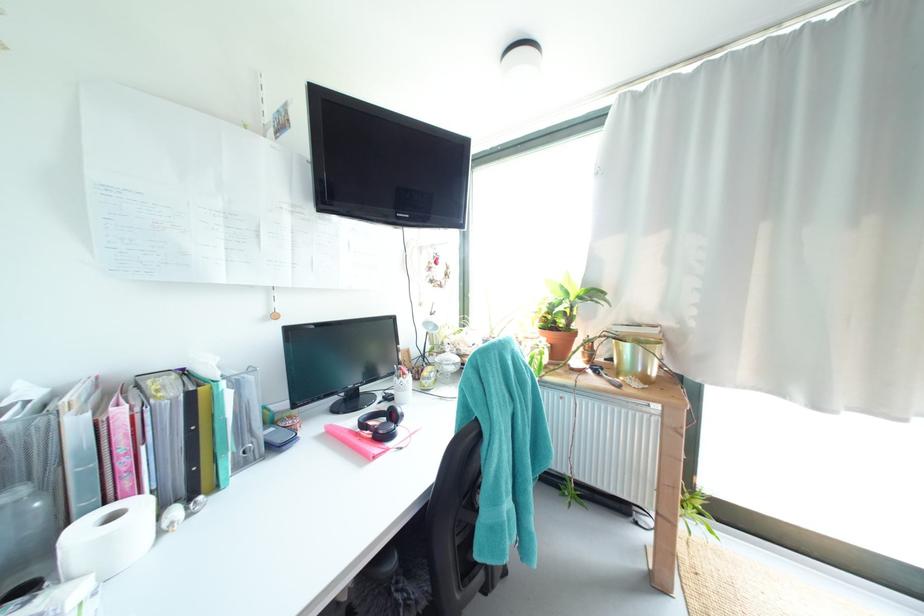
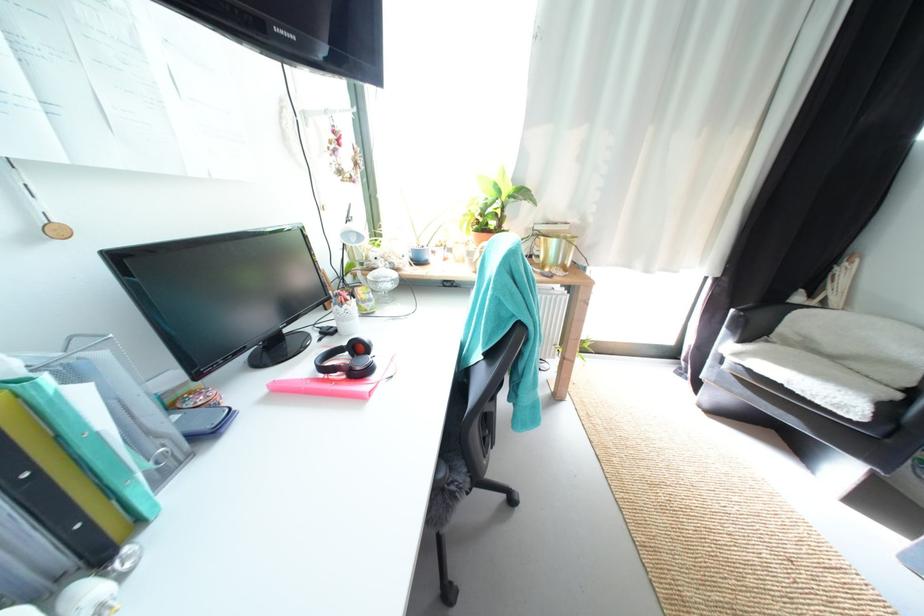
In the second image, find the point that corresponds to [434,325] in the first image.

(354, 236)